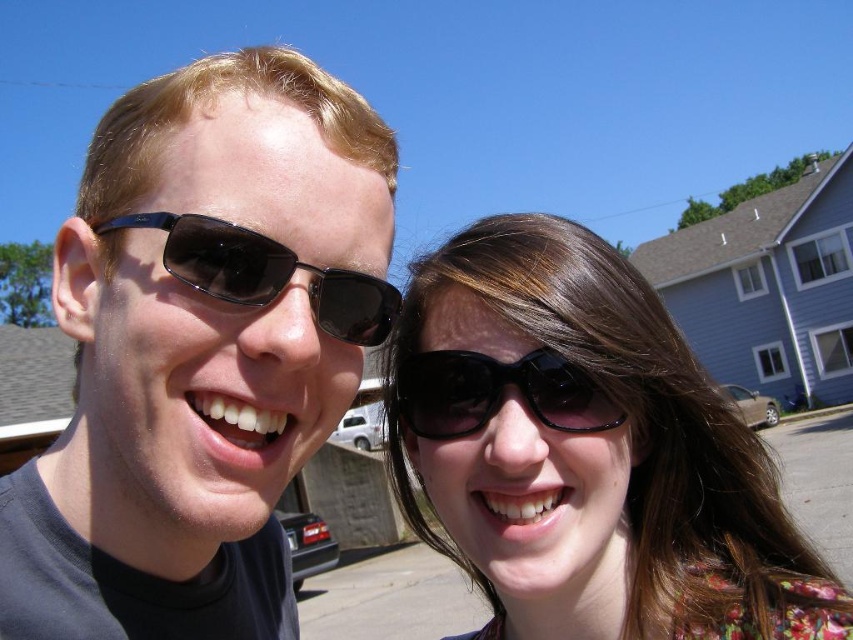
You are trying to decide which pair of sunglasses to buy based on the image. The black plastic sunglasses at left and the black shiny sunglasses at center are both options. If you want a pair that is wider, which one should you choose?

The black plastic sunglasses at left might be wider than black shiny sunglasses at center, so you should choose the black plastic sunglasses at left if you want wider ones.

Based on the coordinates provided, which object is positioned at point (200, 349)?

The matte black sunglasses at left is positioned at point (200, 349).

Based on the photo, you are trying to decide which pair of sunglasses to buy based on their size. You want the wider pair. Which one should you choose between the matte black sunglasses at left and the black shiny sunglasses at center?

The matte black sunglasses at left are wider than the black shiny sunglasses at center, so you should choose the matte black sunglasses at left.